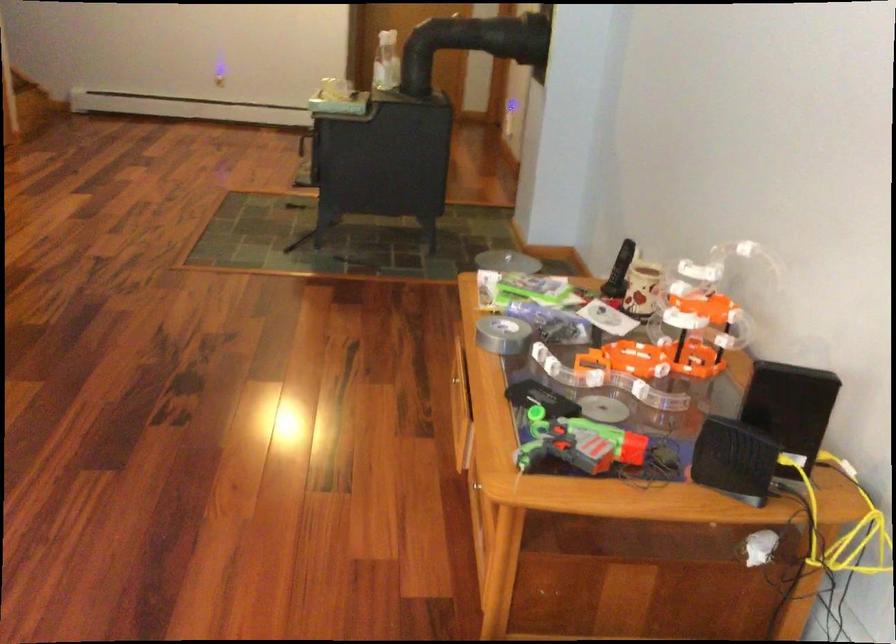
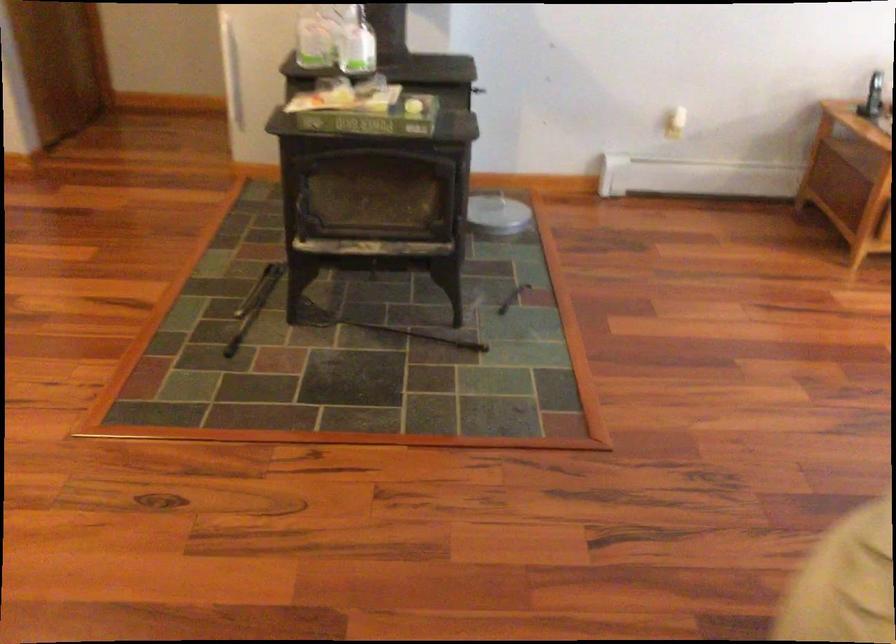
Locate, in the second image, the point that corresponds to point (386, 73) in the first image.

(314, 41)